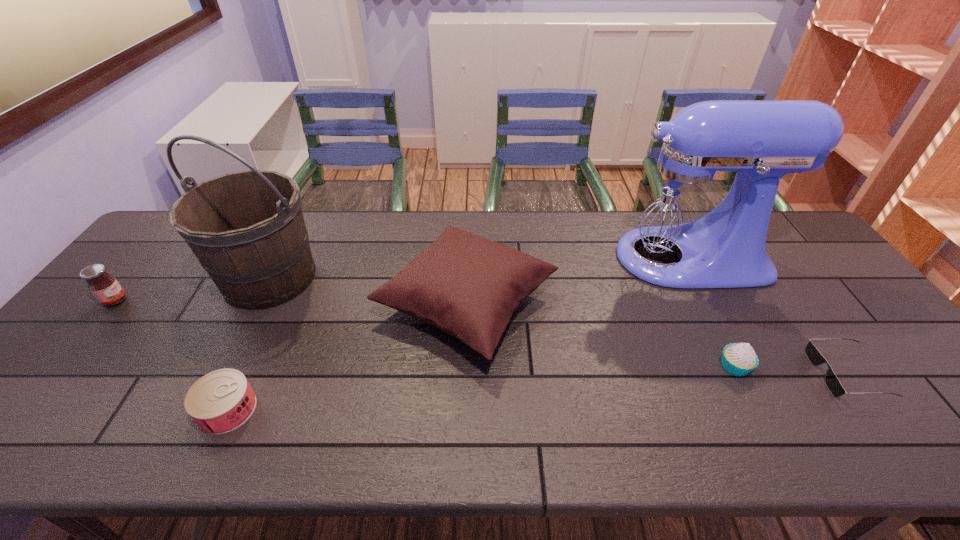
Locate an element on the screen. This screenshot has height=540, width=960. mixer is located at coordinates (686, 222).

Where is `bucket`? This screenshot has width=960, height=540. bucket is located at coordinates (247, 230).

You are a GUI agent. You are given a task and a screenshot of the screen. Output one action in this format:
    pyautogui.click(x=<x>, y=<y>)
    Task: Click on the cushion
    This screenshot has height=540, width=960.
    Given the screenshot: What is the action you would take?
    pyautogui.click(x=468, y=286)

At what (x,y) coordinates should I click in order to perform the action: click on the third tallest object. Please return your answer as a coordinate pair (x, y). The width and height of the screenshot is (960, 540). Looking at the image, I should click on (468, 286).

Locate an element on the screen. The width and height of the screenshot is (960, 540). the fourth shortest object is located at coordinates (106, 289).

Identify the location of the leftmost object. The image size is (960, 540). (106, 289).

Locate an element on the screen. The width and height of the screenshot is (960, 540). the fifth tallest object is located at coordinates (739, 359).

At what (x,y) coordinates should I click in order to perform the action: click on the sixth tallest object. Please return your answer as a coordinate pair (x, y). Looking at the image, I should click on (221, 401).

You are a GUI agent. You are given a task and a screenshot of the screen. Output one action in this format:
    pyautogui.click(x=<x>, y=<y>)
    Task: Click on the sunglasses
    This screenshot has height=540, width=960.
    Given the screenshot: What is the action you would take?
    pyautogui.click(x=832, y=383)

Where is `free space located at the mixing area of the mixer`? This screenshot has height=540, width=960. free space located at the mixing area of the mixer is located at coordinates (524, 258).